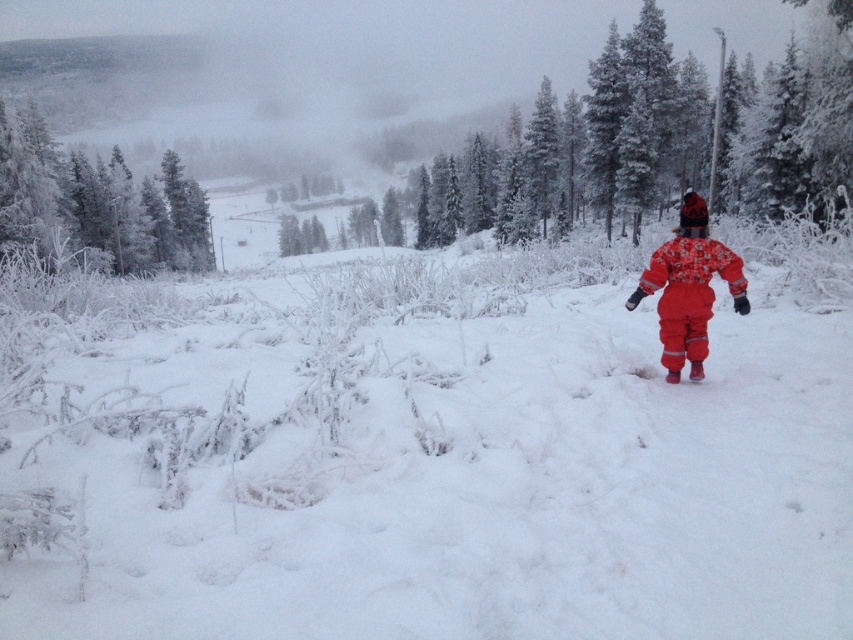
You are standing at the point with coordinates point (677, 257) and want to walk to the point with coordinates point (53, 173). Which direction should you move in to reach your destination?

To reach point (53, 173) from point (677, 257), you should move towards the upper left direction since point (53, 173) is located behind point (677, 257).

Consider the image. You are standing in the winter scene and want to reach the point marked as point (x=392, y=428). If you walk straight ahead, will you reach that point before the cluster of evergreen trees?

The point (x=392, y=428) is 5.09 meters away from the viewer. Since the cluster of evergreen trees is in the background, which is further away than the point, walking straight ahead will reach the point before the trees.

You are a photographer trying to capture the entire snowy landscape in one frame. Given that your camera can only focus on objects within a 10m width, can you fit both the white fluffy snow at center and the frosted pine trees at left into the frame?

The white fluffy snow at center is wider than the frosted pine trees at left, so if the total width of both objects combined is within 10 meters, they can fit. However, since the description only states the snow is wider than the trees but doesn